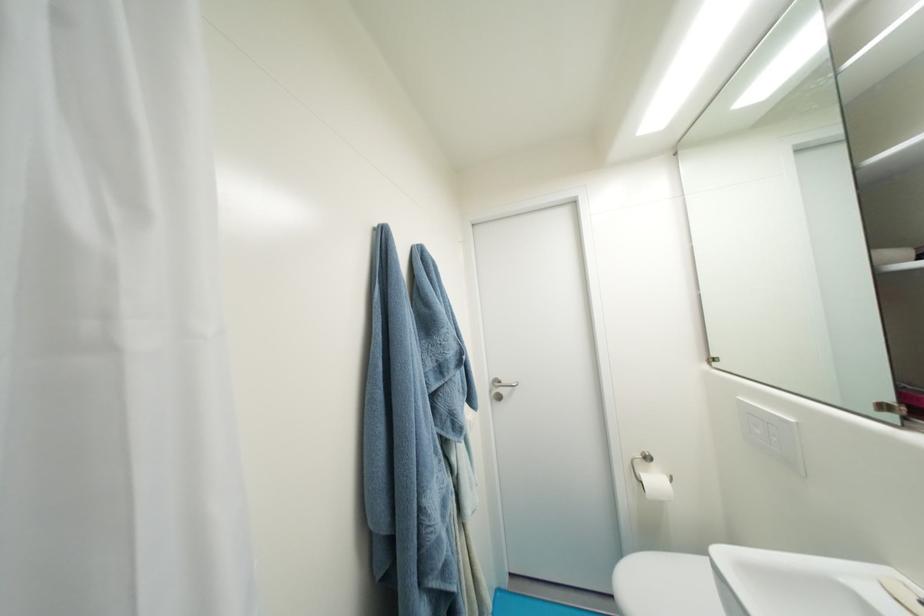
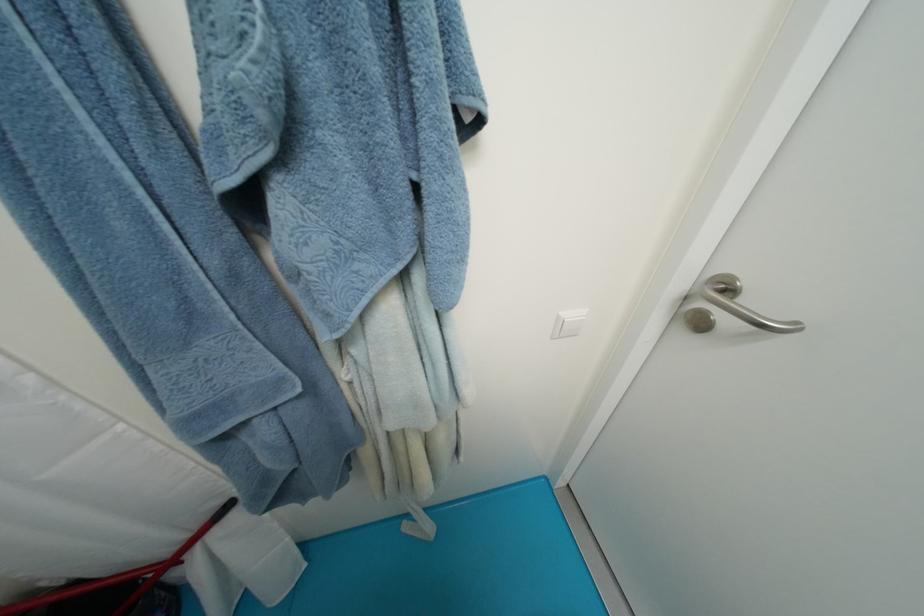
How did the camera likely rotate?

The rotation direction of the camera is left-down.